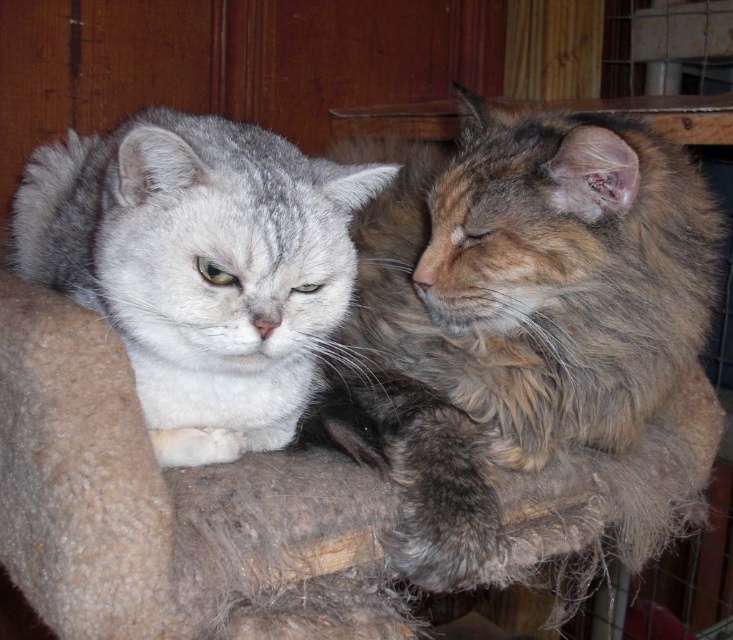
Is fluffy brown cat at right positioned before gray fur cat at left?

No.

Which is in front, point (430, 385) or point (205, 125)?

Point (205, 125)

This screenshot has width=733, height=640. I want to click on fluffy brown cat at right, so click(x=515, y=308).